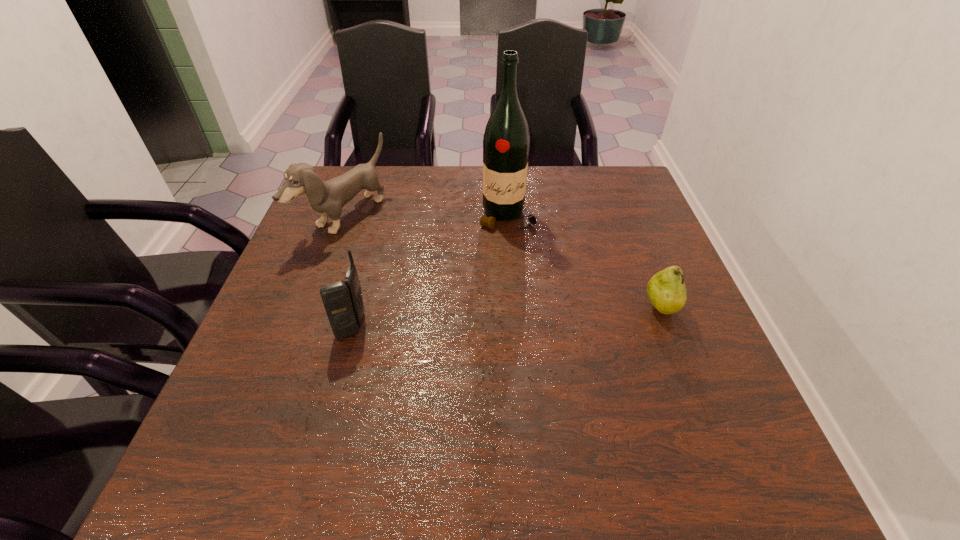
The image size is (960, 540). Identify the location of free space located 0.090m on the surface of the tallest object. (512, 256).

Where is `free space located on the surface of the tallest object`? This screenshot has height=540, width=960. free space located on the surface of the tallest object is located at coordinates (515, 276).

I want to click on free point located 0.170m on the surface of the tallest object, so (515, 279).

Locate an element on the screen. This screenshot has height=540, width=960. free space located 0.050m at the face of the puppy is located at coordinates tap(385, 243).

What are the coordinates of `free space located at the face of the puppy` in the screenshot? It's located at (471, 286).

Where is `free space located 0.360m at the face of the puppy`? Image resolution: width=960 pixels, height=540 pixels. free space located 0.360m at the face of the puppy is located at coordinates (486, 293).

Identify the location of wine bottle present at the far edge. coord(506,141).

Image resolution: width=960 pixels, height=540 pixels. Identify the location of puppy that is positioned at the far edge. (327, 198).

The image size is (960, 540). Identify the location of object situated at the left edge. (327, 198).

At what (x,y) coordinates should I click in order to perform the action: click on object that is positioned at the right edge. Please return your answer as a coordinate pair (x, y). Looking at the image, I should click on click(666, 290).